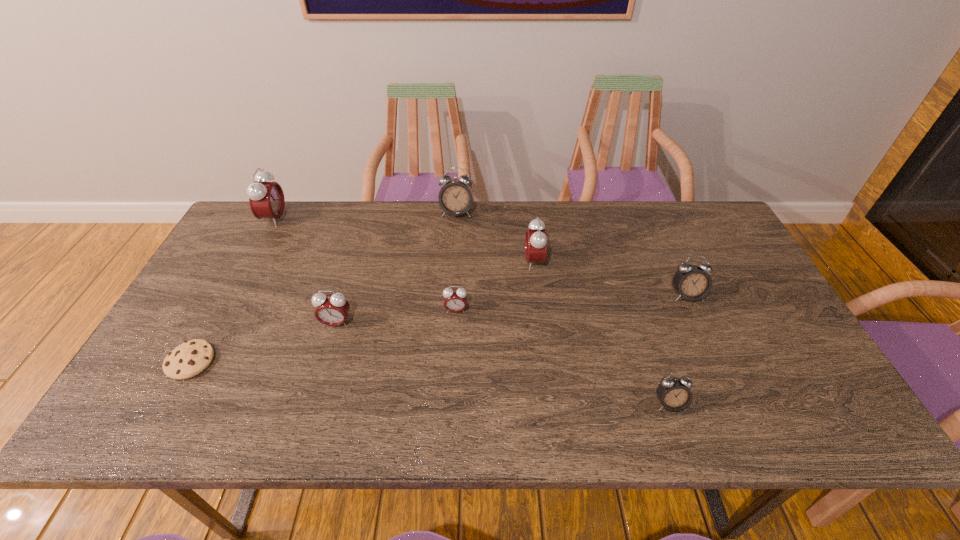
The width and height of the screenshot is (960, 540). I want to click on free space at the near edge, so click(x=580, y=412).

Find the location of a particular element. This screenshot has height=540, width=960. free location at the left edge of the desktop is located at coordinates (224, 264).

In the image, there is a desktop. At what (x,y) coordinates should I click in order to perform the action: click on vacant space at the right edge. Please return your answer as a coordinate pair (x, y). The image size is (960, 540). Looking at the image, I should click on click(722, 261).

Image resolution: width=960 pixels, height=540 pixels. In the image, there is a desktop. In order to click on vacant area at the far left corner in this screenshot , I will do `click(282, 237)`.

Find the location of a particular element. This screenshot has width=960, height=540. free space at the near left corner is located at coordinates (137, 406).

This screenshot has width=960, height=540. What are the coordinates of `blank space at the far right corner of the desktop` in the screenshot? It's located at (724, 245).

You are a GUI agent. You are given a task and a screenshot of the screen. Output one action in this format:
    pyautogui.click(x=<x>, y=<y>)
    Task: Click on the vacant area that lies between the sixth farthest alarm clock and the tallest object
    This screenshot has height=540, width=960.
    Given the screenshot: What is the action you would take?
    pyautogui.click(x=305, y=271)

Find the location of a particular element. The image size is (960, 540). unoccupied position between the tallest object and the second pink alarm clock from left to right is located at coordinates (305, 271).

This screenshot has height=540, width=960. In order to click on vacant space in between the second farthest pink alarm clock and the third pink alarm clock from left to right in this screenshot , I will do `click(495, 286)`.

What are the coordinates of `vacant space that is in between the cookie and the second pink alarm clock from right to left` in the screenshot? It's located at (324, 336).